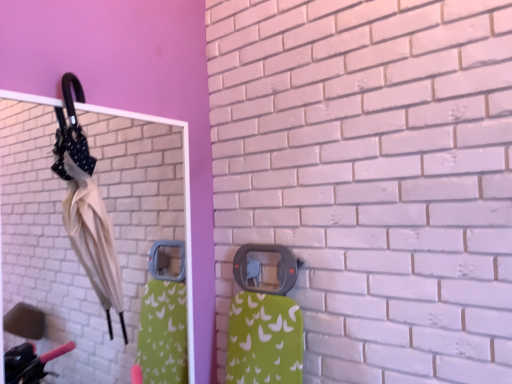
Where is `matte plastic door handle at center`? matte plastic door handle at center is located at coordinates (264, 266).

Where is `white glossy mirror at upper left`? The image size is (512, 384). white glossy mirror at upper left is located at coordinates (67, 235).

Which of these two, matte plastic door handle at center or white glossy mirror at upper left, is thinner?

Thinner between the two is white glossy mirror at upper left.

From their relative heights in the image, would you say matte plastic door handle at center is taller or shorter than white glossy mirror at upper left?

Considering their sizes, matte plastic door handle at center has less height than white glossy mirror at upper left.

The height and width of the screenshot is (384, 512). Identify the location of door handle located underneath the white glossy mirror at upper left (from a real-world perspective). (264, 266).

From the image's perspective, is matte plastic door handle at center under white glossy mirror at upper left?

Yes, from the image's perspective, matte plastic door handle at center is beneath white glossy mirror at upper left.

Measure the distance between white glossy mirror at upper left and matte plastic door handle at center.

The distance of white glossy mirror at upper left from matte plastic door handle at center is 1.22 meters.

Choose the correct answer: Is white glossy mirror at upper left inside matte plastic door handle at center or outside it?

white glossy mirror at upper left is not enclosed by matte plastic door handle at center.

From the image's perspective, which is above, white glossy mirror at upper left or matte plastic door handle at center?

white glossy mirror at upper left.

Considering the sizes of objects white glossy mirror at upper left and matte plastic door handle at center in the image provided, who is shorter, white glossy mirror at upper left or matte plastic door handle at center?

With less height is matte plastic door handle at center.

Is matte plastic door handle at center not within beige fabric umbrella at left?

Indeed, matte plastic door handle at center is completely outside beige fabric umbrella at left.

Where is `umbrella on the left of matte plastic door handle at center`? This screenshot has width=512, height=384. umbrella on the left of matte plastic door handle at center is located at coordinates (86, 206).

How distant is matte plastic door handle at center from beige fabric umbrella at left?

23.24 inches.

From the image's perspective, is matte plastic door handle at center beneath beige fabric umbrella at left?

Correct, matte plastic door handle at center appears lower than beige fabric umbrella at left in the image.

Which of these two, white glossy mirror at upper left or beige fabric umbrella at left, stands shorter?

With less height is beige fabric umbrella at left.

Which is more to the right, white glossy mirror at upper left or beige fabric umbrella at left?

From the viewer's perspective, white glossy mirror at upper left appears more on the right side.

Is white glossy mirror at upper left positioned with its back to beige fabric umbrella at left?

Yes, white glossy mirror at upper left is positioned with its back facing beige fabric umbrella at left.

Which is farther from the camera, (x=10, y=142) or (x=120, y=321)?

Point (x=10, y=142)

Is beige fabric umbrella at left looking in the opposite direction of matte plastic door handle at center?

No, beige fabric umbrella at left is not facing the opposite direction of matte plastic door handle at center.

Which object is positioned more to the left, beige fabric umbrella at left or matte plastic door handle at center?

beige fabric umbrella at left.

Is beige fabric umbrella at left next to matte plastic door handle at center and touching it?

No, beige fabric umbrella at left is not in contact with matte plastic door handle at center.

Is beige fabric umbrella at left thinner than matte plastic door handle at center?

No.

Considering the positions of objects beige fabric umbrella at left and white glossy mirror at upper left in the image provided, who is more to the left, beige fabric umbrella at left or white glossy mirror at upper left?

Positioned to the left is beige fabric umbrella at left.

What's the angular difference between beige fabric umbrella at left and white glossy mirror at upper left's facing directions?

There is a 1.42-degree angle between the facing directions of beige fabric umbrella at left and white glossy mirror at upper left.

Based on the photo, considering the sizes of objects beige fabric umbrella at left and white glossy mirror at upper left in the image provided, who is bigger, beige fabric umbrella at left or white glossy mirror at upper left?

With larger size is white glossy mirror at upper left.

In the image, there is a white glossy mirror at upper left. Identify the location of door handle below it (from the image's perspective). (264, 266).

Image resolution: width=512 pixels, height=384 pixels. In order to click on door handle behind the white glossy mirror at upper left in this screenshot , I will do `click(264, 266)`.

Based on their spatial positions, is matte plastic door handle at center or white glossy mirror at upper left further from beige fabric umbrella at left?

white glossy mirror at upper left lies further to beige fabric umbrella at left than the other object.

Considering their positions, is white glossy mirror at upper left positioned further to matte plastic door handle at center than beige fabric umbrella at left?

white glossy mirror at upper left is positioned further to the anchor matte plastic door handle at center.

Considering their positions, is beige fabric umbrella at left positioned closer to white glossy mirror at upper left than matte plastic door handle at center?

Based on the image, beige fabric umbrella at left appears to be nearer to white glossy mirror at upper left.

Considering their positions, is matte plastic door handle at center positioned further to white glossy mirror at upper left than beige fabric umbrella at left?

Among the two, matte plastic door handle at center is located further to white glossy mirror at upper left.

Which object lies further to the anchor point matte plastic door handle at center, beige fabric umbrella at left or white glossy mirror at upper left?

Based on the image, white glossy mirror at upper left appears to be further to matte plastic door handle at center.

Which object lies further to the anchor point beige fabric umbrella at left, white glossy mirror at upper left or matte plastic door handle at center?

white glossy mirror at upper left.

Find the location of `mirror between beige fabric umbrella at left and matte plastic door handle at center from left to right`. mirror between beige fabric umbrella at left and matte plastic door handle at center from left to right is located at coordinates (67, 235).